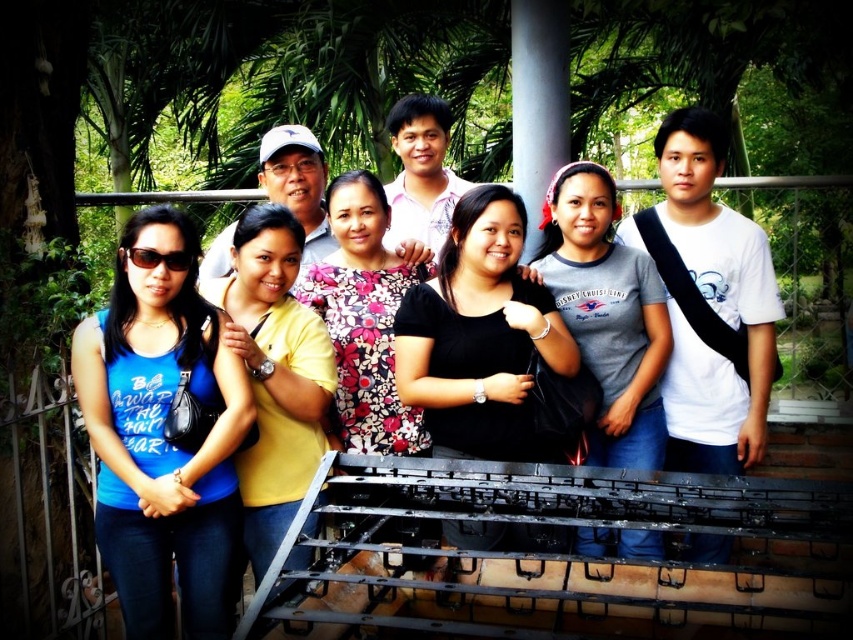
Question: Among these objects, which one is nearest to the camera?

Choices:
 (A) gray cotton t-shirt at center
 (B) floral-patterned blouse at center

Answer: (B)

Question: Which point is closer to the camera?

Choices:
 (A) (219, 618)
 (B) (643, 538)
 (C) (358, 403)

Answer: (A)

Question: Does yellow matte shirt at center have a greater width compared to floral-patterned blouse at center?

Choices:
 (A) no
 (B) yes

Answer: (B)

Question: Considering the relative positions of black matte shirt at center and gray cotton t-shirt at center in the image provided, where is black matte shirt at center located with respect to gray cotton t-shirt at center?

Choices:
 (A) left
 (B) right

Answer: (A)

Question: Which point appears farthest from the camera in this image?

Choices:
 (A) (611, 348)
 (B) (199, 314)
 (C) (306, 340)

Answer: (A)

Question: Is yellow matte shirt at center thinner than floral-patterned blouse at center?

Choices:
 (A) no
 (B) yes

Answer: (A)